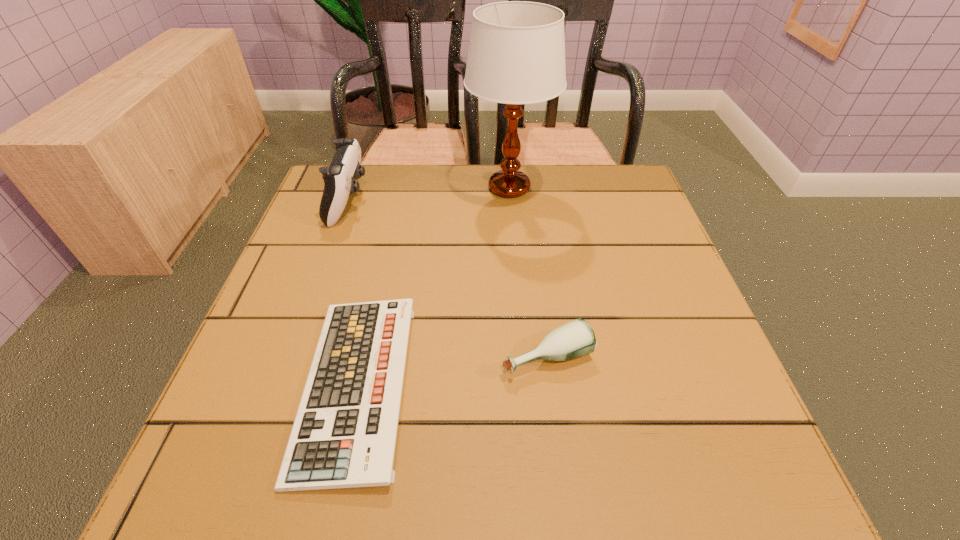
This screenshot has width=960, height=540. In order to click on free space that satisfies the following two spatial constraints: 1. on the front-facing side of the third shortest object; 2. on the right side of the bottle in this screenshot , I will do click(x=294, y=356).

Locate an element on the screen. The width and height of the screenshot is (960, 540). vacant region that satisfies the following two spatial constraints: 1. on the back side of the computer keyboard; 2. on the left side of the table lamp is located at coordinates (400, 188).